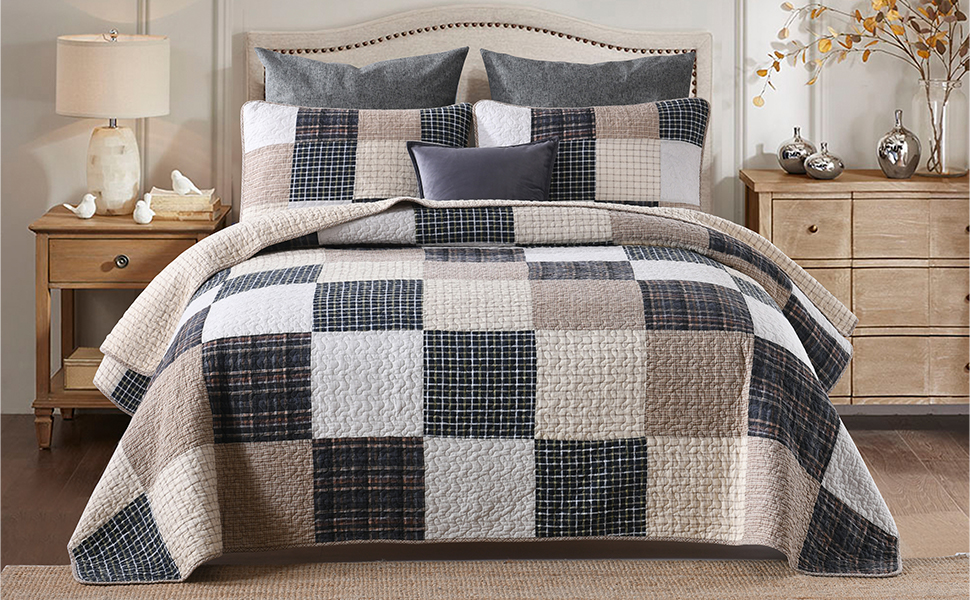
In order to click on rug in this screenshot , I will do `click(740, 572)`.